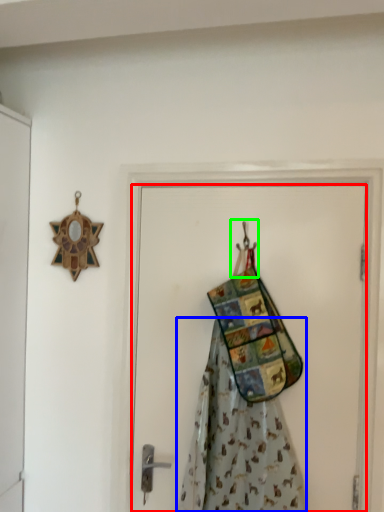
Question: Estimate the real-world distances between objects in this image. Which object is closer to door (highlighted by a red box), fancy dress (highlighted by a blue box) or hanger (highlighted by a green box)?

Choices:
 (A) fancy dress
 (B) hanger

Answer: (A)